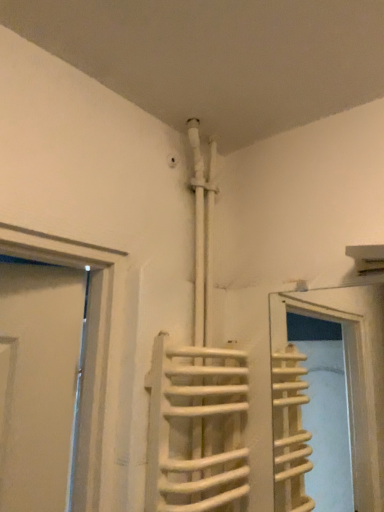
This screenshot has height=512, width=384. Identify the location of white matte radiator at center. (205, 431).

Measure the distance between point (x=225, y=445) and camera.

Point (x=225, y=445) and camera are 1.06 meters apart.

The image size is (384, 512). What do you see at coordinates (205, 431) in the screenshot?
I see `white matte radiator at center` at bounding box center [205, 431].

What is the approximate width of white matte radiator at center?

white matte radiator at center is 4.57 inches wide.

In order to click on white matte radiator at center in this screenshot , I will do `click(205, 431)`.